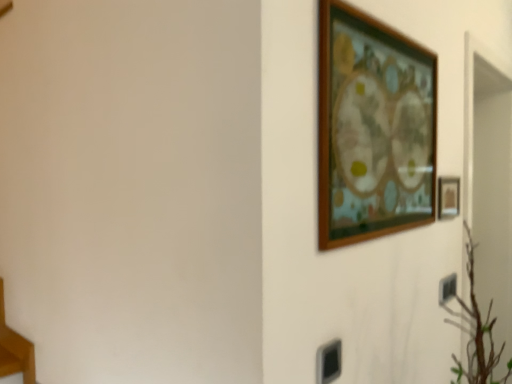
What is the approximate height of wooden picture frame at upper right, arranged as the second picture frame when viewed from the right?

It is 21.54 inches.

What do you see at coordinates (15, 349) in the screenshot? Image resolution: width=512 pixels, height=384 pixels. I see `wooden table at lower left` at bounding box center [15, 349].

You are a GUI agent. You are given a task and a screenshot of the screen. Output one action in this format:
    pyautogui.click(x=<x>, y=<y>)
    Task: Click on the wooden picture frame at upper right, the 1th picture frame from the front
    The width and height of the screenshot is (512, 384).
    Given the screenshot: What is the action you would take?
    pyautogui.click(x=372, y=127)

Is wooden picture frame at upper right, arranged as the second picture frame when viewed from the right, in contact with black plastic electric outlet at lower right?

No, wooden picture frame at upper right, arranged as the second picture frame when viewed from the right, is not with black plastic electric outlet at lower right.

From a real-world perspective, between wooden picture frame at upper right, which is the second picture frame from back to front, and black plastic electric outlet at lower right, who is vertically higher?

In real-world perspective, wooden picture frame at upper right, which is the second picture frame from back to front, is above.

Which is in front, point (379, 135) or point (447, 279)?

The point (379, 135) is closer.

Is wooden picture frame at right, marked as the second picture frame in a left-to-right arrangement, facing towards black plastic electric outlet at lower right?

No, wooden picture frame at right, marked as the second picture frame in a left-to-right arrangement, is not aimed at black plastic electric outlet at lower right.

From a real-world perspective, does wooden picture frame at right, which ranks as the 1th picture frame in right-to-left order, sit lower than black plastic electric outlet at lower right?

No, from a real-world perspective, wooden picture frame at right, which ranks as the 1th picture frame in right-to-left order, is not below black plastic electric outlet at lower right.

Is wooden picture frame at right, which ranks as the 1th picture frame in right-to-left order, inside or outside of black plastic electric outlet at lower right?

wooden picture frame at right, which ranks as the 1th picture frame in right-to-left order, is outside black plastic electric outlet at lower right.

Is wooden picture frame at right, marked as the second picture frame in a front-to-back arrangement, bigger or smaller than black plastic electric outlet at lower right?

Clearly, wooden picture frame at right, marked as the second picture frame in a front-to-back arrangement, is larger in size than black plastic electric outlet at lower right.

Can you tell me how much wooden picture frame at right, which ranks as the 1th picture frame in right-to-left order, and wooden table at lower left differ in facing direction?

The angular difference between wooden picture frame at right, which ranks as the 1th picture frame in right-to-left order, and wooden table at lower left is 91.1 degrees.

In the scene shown: Is wooden picture frame at right, marked as the second picture frame in a left-to-right arrangement, not within wooden table at lower left?

Indeed, wooden picture frame at right, marked as the second picture frame in a left-to-right arrangement, is completely outside wooden table at lower left.

Considering the sizes of objects wooden picture frame at right, marked as the second picture frame in a left-to-right arrangement, and wooden table at lower left in the image provided, who is taller, wooden picture frame at right, marked as the second picture frame in a left-to-right arrangement, or wooden table at lower left?

wooden table at lower left is taller.

Based on the photo, is wooden picture frame at right, marked as the second picture frame in a front-to-back arrangement, to the left of wooden table at lower left from the viewer's perspective?

No.

Would you say black plastic electric outlet at lower right is part of wooden table at lower left's contents?

No.

Could you tell me if wooden table at lower left is turned towards black plastic electric outlet at lower right?

No, wooden table at lower left does not turn towards black plastic electric outlet at lower right.

Which of these two, wooden table at lower left or black plastic electric outlet at lower right, stands shorter?

black plastic electric outlet at lower right.

From a real-world perspective, which is physically below, wooden table at lower left or black plastic electric outlet at lower right?

wooden table at lower left.

Is wooden table at lower left surrounded by wooden picture frame at upper right, arranged as the second picture frame when viewed from the right?

That's incorrect, wooden table at lower left is not inside wooden picture frame at upper right, arranged as the second picture frame when viewed from the right.

Considering the sizes of objects wooden picture frame at upper right, the first picture frame when ordered from left to right, and wooden table at lower left in the image provided, who is smaller, wooden picture frame at upper right, the first picture frame when ordered from left to right, or wooden table at lower left?

With smaller size is wooden table at lower left.

How many degrees apart are the facing directions of wooden picture frame at upper right, arranged as the second picture frame when viewed from the right, and wooden table at lower left?

91.2 degrees separate the facing orientations of wooden picture frame at upper right, arranged as the second picture frame when viewed from the right, and wooden table at lower left.

Considering the relative positions of wooden picture frame at upper right, the 1th picture frame from the front, and wooden table at lower left in the image provided, is wooden picture frame at upper right, the 1th picture frame from the front, to the right of wooden table at lower left from the viewer's perspective?

Correct, you'll find wooden picture frame at upper right, the 1th picture frame from the front, to the right of wooden table at lower left.

Based on the photo, which is in front, black plastic electric outlet at lower right or wooden picture frame at upper right, which is the second picture frame from back to front?

wooden picture frame at upper right, which is the second picture frame from back to front, is closer to the camera.

Is black plastic electric outlet at lower right spatially inside wooden picture frame at upper right, the first picture frame when ordered from left to right, or outside of it?

black plastic electric outlet at lower right is outside wooden picture frame at upper right, the first picture frame when ordered from left to right.

Is point (455, 283) closer to camera compared to point (408, 117)?

That is False.

At what (x,y) coordinates should I click in order to perform the action: click on the 2nd picture frame positioned above the black plastic electric outlet at lower right (from the image's perspective). Please return your answer as a coordinate pair (x, y). Looking at the image, I should click on (372, 127).

How different are the orientations of wooden picture frame at right, which ranks as the 1th picture frame in right-to-left order, and wooden picture frame at upper right, the first picture frame when ordered from left to right, in degrees?

There is a 0.14-degree angle between the facing directions of wooden picture frame at right, which ranks as the 1th picture frame in right-to-left order, and wooden picture frame at upper right, the first picture frame when ordered from left to right.

In the scene shown: In terms of height, does wooden picture frame at right, marked as the second picture frame in a left-to-right arrangement, look taller or shorter compared to wooden picture frame at upper right, the 1th picture frame from the front?

Considering their sizes, wooden picture frame at right, marked as the second picture frame in a left-to-right arrangement, has less height than wooden picture frame at upper right, the 1th picture frame from the front.

The height and width of the screenshot is (384, 512). In order to click on picture frame that is in front of the wooden picture frame at right, which ranks as the 1th picture frame in right-to-left order in this screenshot , I will do `click(372, 127)`.

Does wooden picture frame at right, which ranks as the 1th picture frame in right-to-left order, appear on the right side of wooden picture frame at upper right, arranged as the second picture frame when viewed from the right?

Yes.

The width and height of the screenshot is (512, 384). What are the coordinates of `picture frame that is the 2nd one when counting upward from the black plastic electric outlet at lower right (from the image's perspective)` in the screenshot? It's located at (372, 127).

The image size is (512, 384). Identify the location of electric outlet on the right of wooden picture frame at right, marked as the second picture frame in a left-to-right arrangement. click(x=447, y=288).

Based on their spatial positions, is wooden picture frame at right, placed as the 1th picture frame when sorted from back to front, or black plastic electric outlet at lower right closer to wooden table at lower left?

black plastic electric outlet at lower right lies closer to wooden table at lower left than the other object.

Which object lies further to the anchor point wooden picture frame at right, marked as the second picture frame in a left-to-right arrangement, wooden picture frame at upper right, which is the second picture frame from back to front, or black plastic electric outlet at lower right?

wooden picture frame at upper right, which is the second picture frame from back to front.

When comparing their distances from black plastic electric outlet at lower right, does wooden picture frame at upper right, the 1th picture frame from the front, or wooden picture frame at right, marked as the second picture frame in a left-to-right arrangement, seem further?

wooden picture frame at upper right, the 1th picture frame from the front.

From the image, which object appears to be farther from wooden picture frame at upper right, the 1th picture frame from the front, wooden table at lower left or wooden picture frame at right, marked as the second picture frame in a front-to-back arrangement?

wooden table at lower left.

Based on the photo, from the image, which object appears to be nearer to wooden picture frame at upper right, the first picture frame when ordered from left to right, wooden picture frame at right, which ranks as the 1th picture frame in right-to-left order, or black plastic electric outlet at lower right?

Based on the image, wooden picture frame at right, which ranks as the 1th picture frame in right-to-left order, appears to be nearer to wooden picture frame at upper right, the first picture frame when ordered from left to right.

Looking at the image, which one is located closer to wooden table at lower left, wooden picture frame at upper right, which is the second picture frame from back to front, or black plastic electric outlet at lower right?

Among the two, wooden picture frame at upper right, which is the second picture frame from back to front, is located nearer to wooden table at lower left.

Which object lies further to the anchor point wooden picture frame at upper right, which is the second picture frame from back to front, black plastic electric outlet at lower right or wooden table at lower left?

The object further to wooden picture frame at upper right, which is the second picture frame from back to front, is wooden table at lower left.

Considering their positions, is wooden picture frame at right, marked as the second picture frame in a front-to-back arrangement, positioned further to wooden picture frame at upper right, which is the second picture frame from back to front, than wooden table at lower left?

wooden table at lower left is further to wooden picture frame at upper right, which is the second picture frame from back to front.

At what (x,y) coordinates should I click in order to perform the action: click on picture frame between wooden table at lower left and wooden picture frame at right, marked as the second picture frame in a left-to-right arrangement, in the horizontal direction. Please return your answer as a coordinate pair (x, y). Looking at the image, I should click on (372, 127).

This screenshot has width=512, height=384. I want to click on picture frame between wooden picture frame at upper right, the 1th picture frame from the front, and black plastic electric outlet at lower right in the front-back direction, so click(x=448, y=197).